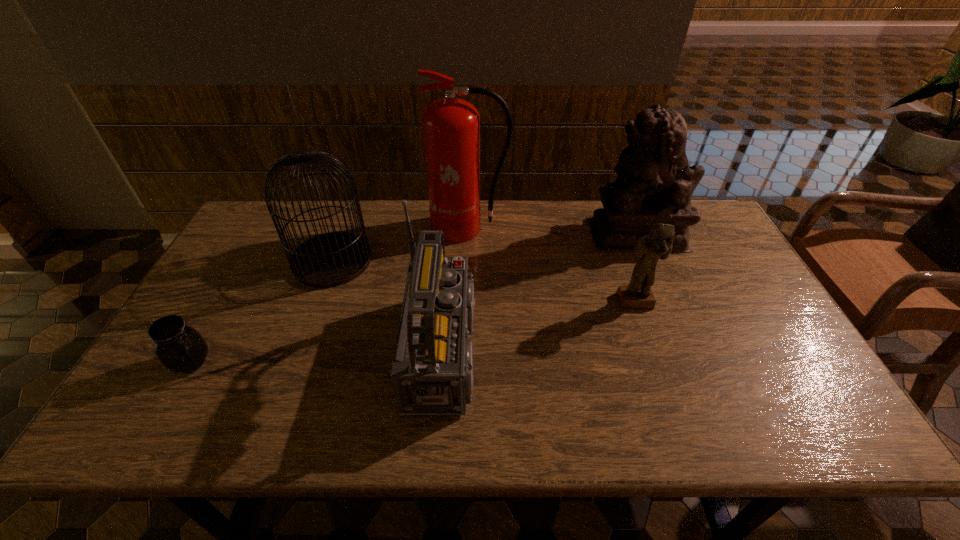
The width and height of the screenshot is (960, 540). Find the location of `vacant space that satisfies the following two spatial constraints: 1. on the front-facing side of the fifth tallest object; 2. on the front-facing side of the radio receiver`. vacant space that satisfies the following two spatial constraints: 1. on the front-facing side of the fifth tallest object; 2. on the front-facing side of the radio receiver is located at coordinates (652, 351).

This screenshot has width=960, height=540. Identify the location of free region that satisfies the following two spatial constraints: 1. on the front side of the birdcage; 2. on the lid of the leftmost object. (296, 362).

Identify the location of vacant area in the image that satisfies the following two spatial constraints: 1. towards the nozzle of the tallest object; 2. on the front-facing side of the radio receiver. This screenshot has width=960, height=540. (467, 351).